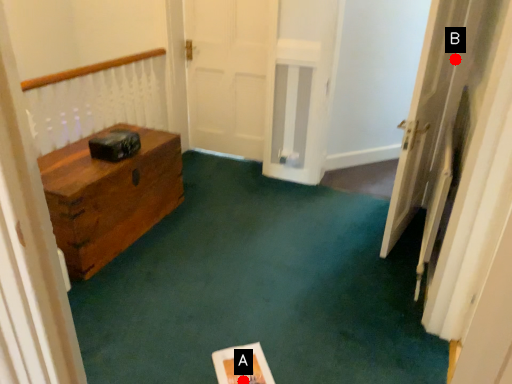
Question: Two points are circled on the image, labeled by A and B beside each circle. Which point is farther to the camera?

Choices:
 (A) A is further
 (B) B is further

Answer: (B)